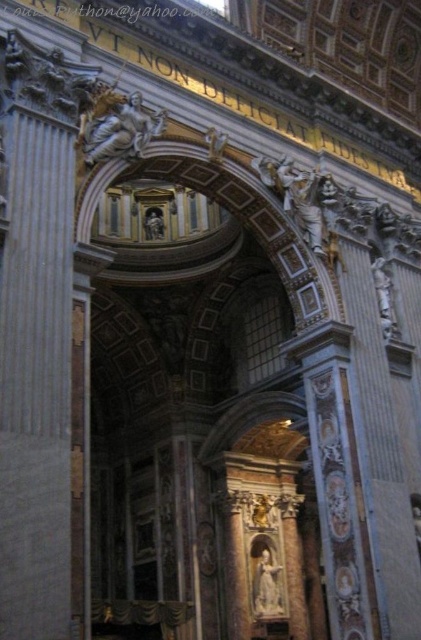
Does white marble statue at upper center appear on the left side of white marble statue at center?

Yes, white marble statue at upper center is to the left of white marble statue at center.

The width and height of the screenshot is (421, 640). What do you see at coordinates (117, 125) in the screenshot? I see `white marble statue at upper center` at bounding box center [117, 125].

You are a GUI agent. You are given a task and a screenshot of the screen. Output one action in this format:
    pyautogui.click(x=<x>, y=<y>)
    Task: Click on the white marble statue at upper center
    This screenshot has width=421, height=640.
    Given the screenshot: What is the action you would take?
    pyautogui.click(x=117, y=125)

From the picture: Can you confirm if white marble statue at center is positioned below white marble statue at right?

Indeed, white marble statue at center is positioned under white marble statue at right.

How far apart are white marble statue at center and white marble statue at right?

102.37 feet

Is point (269, 568) farther from viewer compared to point (383, 333)?

Yes, point (269, 568) is behind point (383, 333).

Locate an element on the screen. The height and width of the screenshot is (640, 421). white marble statue at center is located at coordinates (266, 580).

Image resolution: width=421 pixels, height=640 pixels. Describe the element at coordinates (117, 125) in the screenshot. I see `white marble statue at upper center` at that location.

Can you confirm if white marble statue at upper center is wider than white marble statue at right?

Yes, white marble statue at upper center is wider than white marble statue at right.

Is point (157, 125) closer to viewer compared to point (375, 262)?

Yes.

The image size is (421, 640). Find the location of `white marble statue at upper center`. white marble statue at upper center is located at coordinates (117, 125).